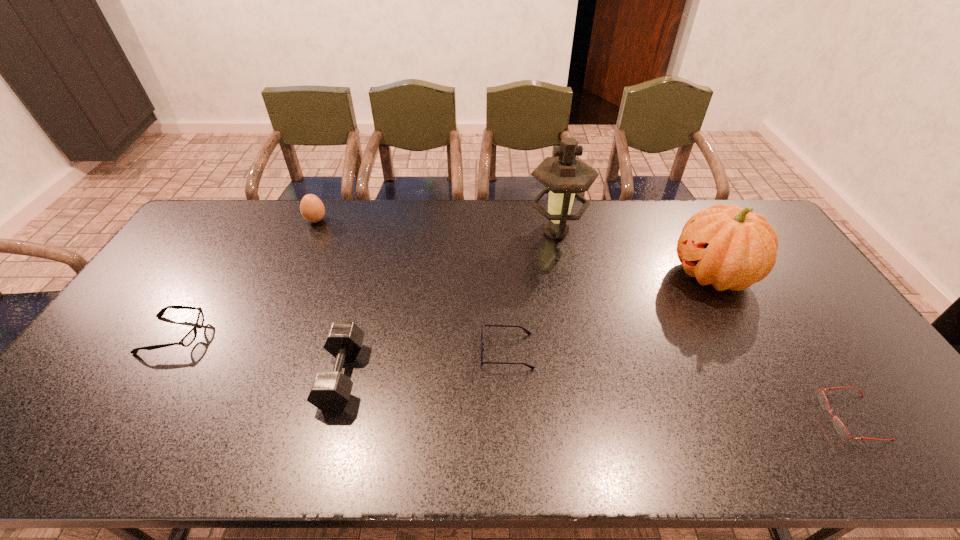
Identify the location of vacant space located 0.070m on the front-facing side of the leftmost object. (227, 335).

Where is `free space located 0.280m on the lenses of the rightmost spectacles`? The width and height of the screenshot is (960, 540). free space located 0.280m on the lenses of the rightmost spectacles is located at coordinates (708, 417).

This screenshot has height=540, width=960. I want to click on vacant space located on the lenses of the rightmost spectacles, so click(x=725, y=417).

The image size is (960, 540). Identify the location of free space located on the lenses of the rightmost spectacles. (666, 417).

Locate an element on the screen. oil lamp situated at the far edge is located at coordinates (566, 176).

You are a GUI agent. You are given a task and a screenshot of the screen. Output one action in this format:
    pyautogui.click(x=<x>, y=<y>)
    Task: Click on the boiled egg that is at the far edge
    
    Given the screenshot: What is the action you would take?
    pyautogui.click(x=312, y=209)

I want to click on object that is at the near edge, so click(x=838, y=425).

The image size is (960, 540). I want to click on object that is at the left edge, so click(x=188, y=339).

Locate an element on the screen. The image size is (960, 540). pumpkin present at the right edge is located at coordinates (731, 248).

This screenshot has width=960, height=540. Identify the location of spectacles situated at the right edge. (838, 425).